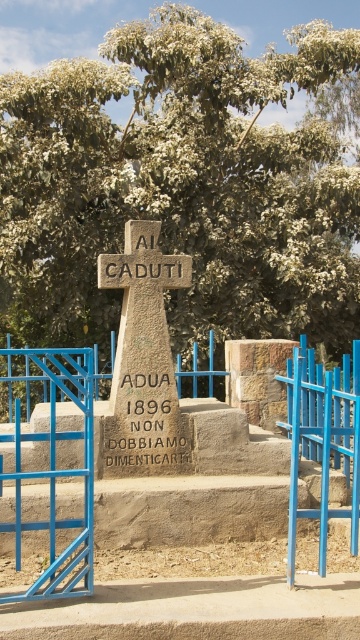
You are standing at the memorial cross monument and want to take a photo of the green leafy tree at center. Where should you position yourself to capture the tree in the photo?

You should position yourself at point [183,182] to capture the green leafy tree at center in the photo.

You are standing at the base of the brown stone stairs at center and want to reach the stone cross at center. Which direction should you move to get there?

You should move upward along the brown stone stairs at center to reach the stone cross at center since it is positioned under the stone cross at center.

In the scene shown: You are a landscape architect designing a new memorial garden. You need to ensure that the stone cross at center is visible from all angles around the green leafy tree at center. Based on their sizes, will the tree block the view of the cross? Please explain.

The green leafy tree at center is smaller than the stone cross at center. Since the tree is smaller, it is unlikely to block the view of the cross from all angles, ensuring the cross remains visible.